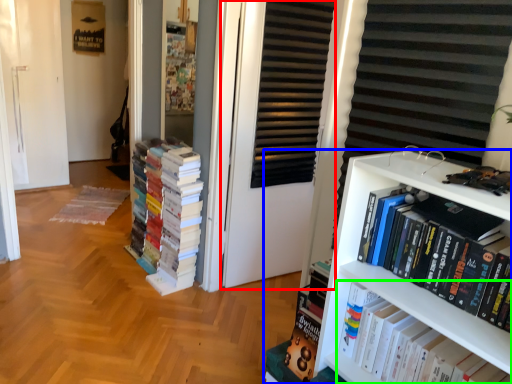
Question: Which is nearer to the screen door (highlighted by a red box)? bookcase (highlighted by a blue box) or book (highlighted by a green box).

Choices:
 (A) bookcase
 (B) book

Answer: (A)